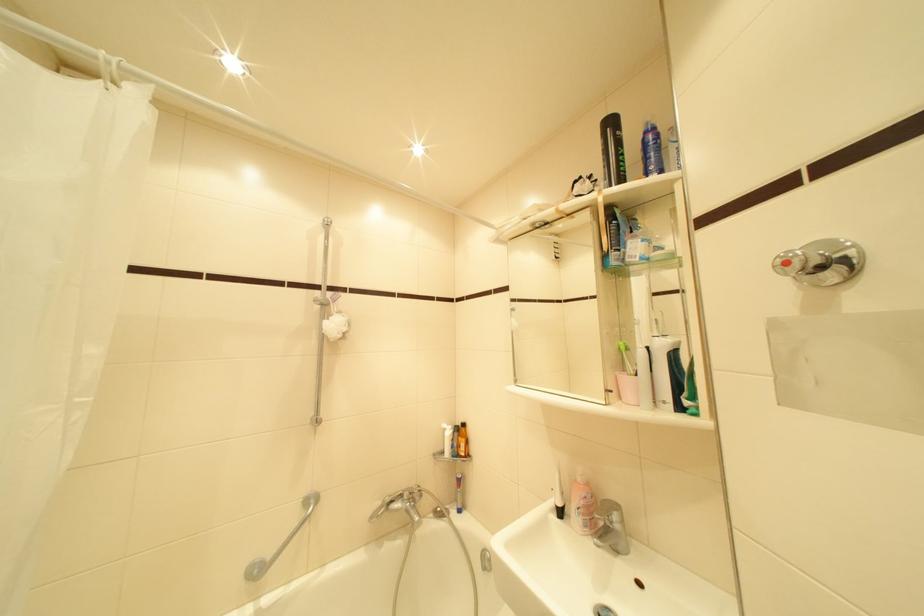
The location [651,150] corresponds to which object?

It corresponds to the blue spray bottle in the image.